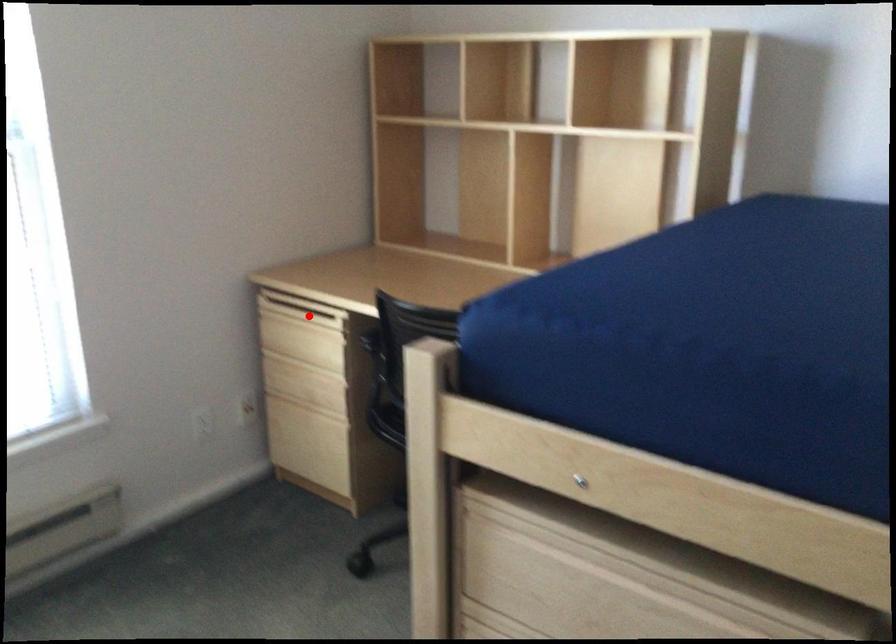
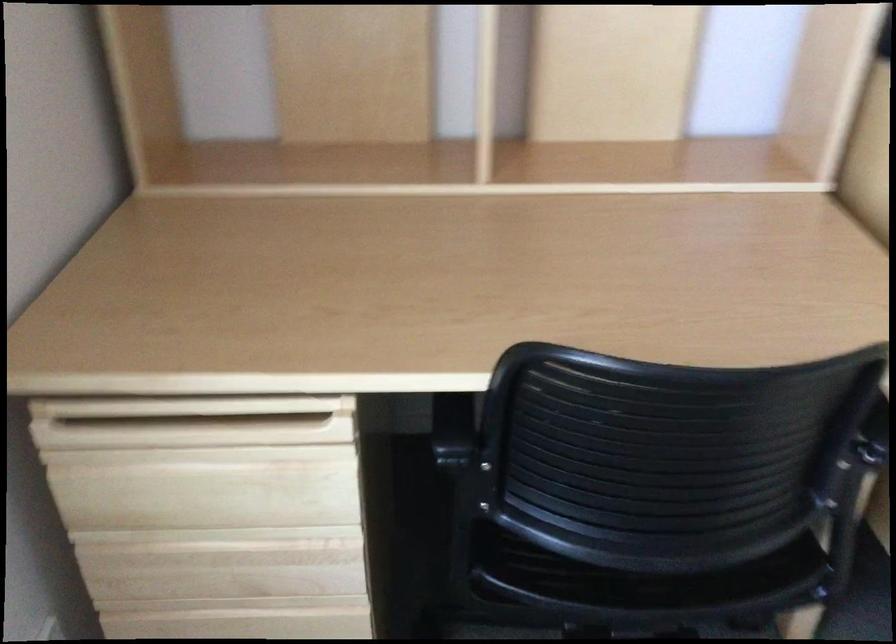
Question: A red point is marked in image1. In image2, is the corresponding 3D point closer to the camera or farther? Reply with the corresponding letter.

Choices:
 (A) The corresponding 3D point is closer.
 (B) The corresponding 3D point is farther.

Answer: (A)